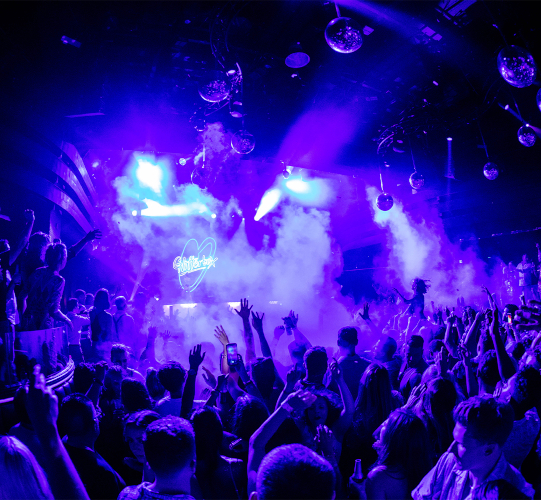
This screenshot has height=500, width=541. Find the location of `light`. light is located at coordinates (270, 192).